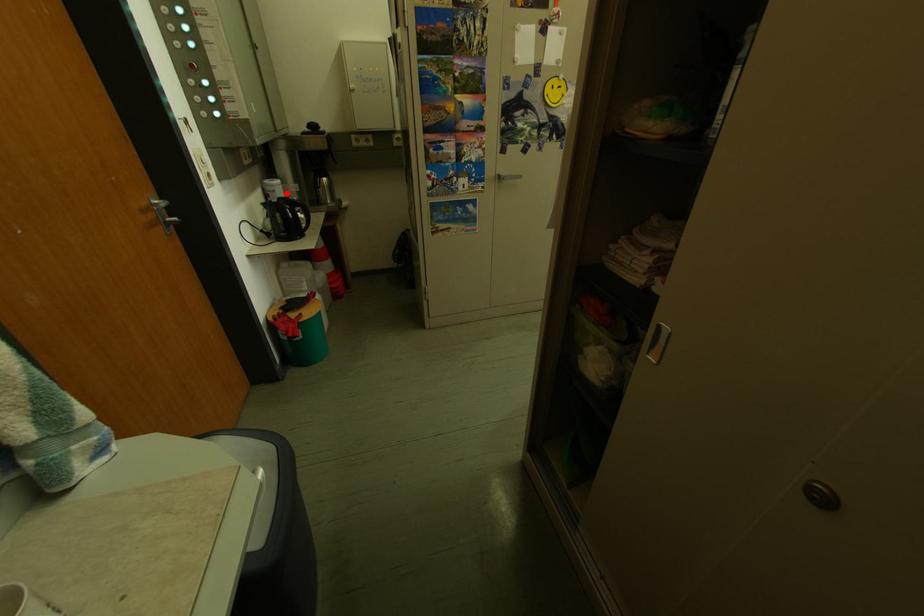
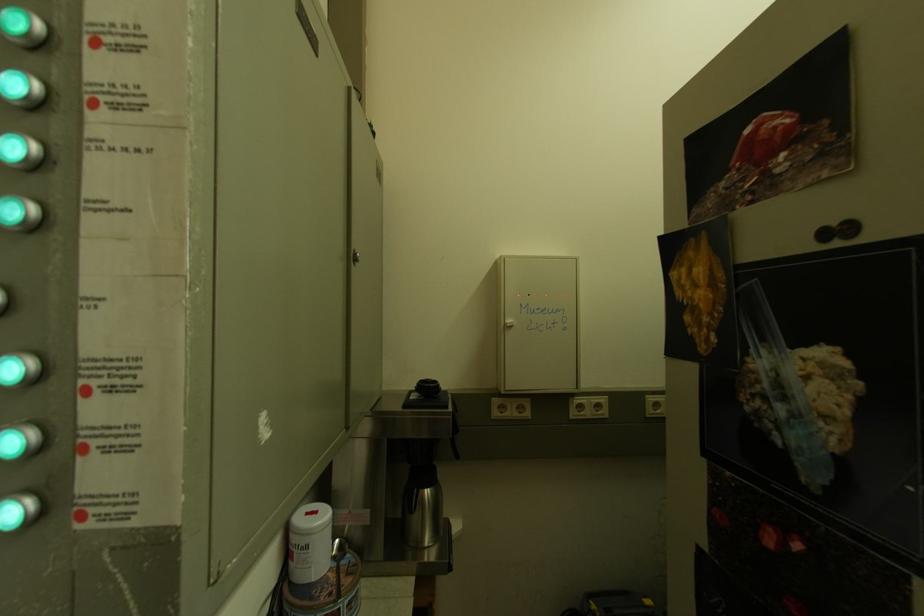
In the second image, find the point that corresponds to the highlighted location in the first image.

(320, 551)